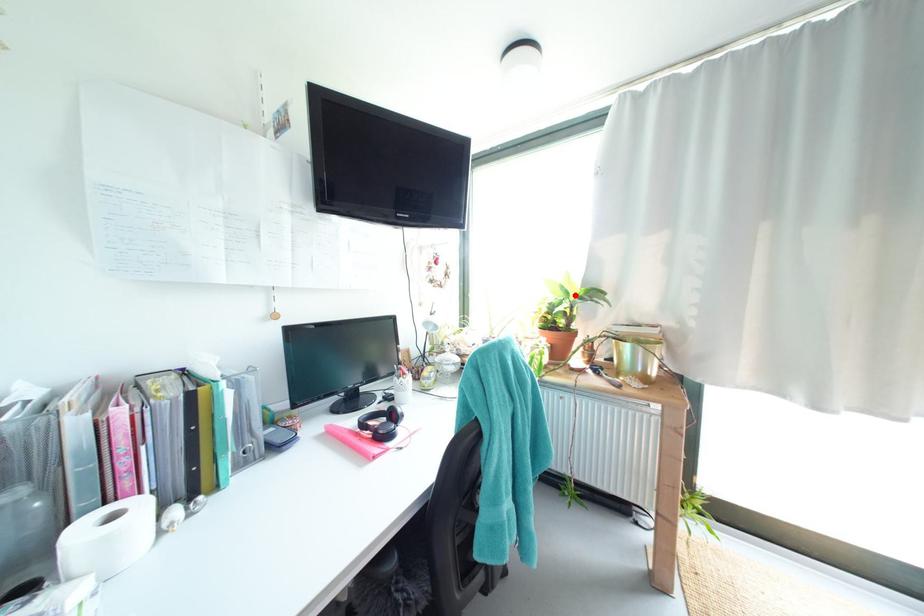
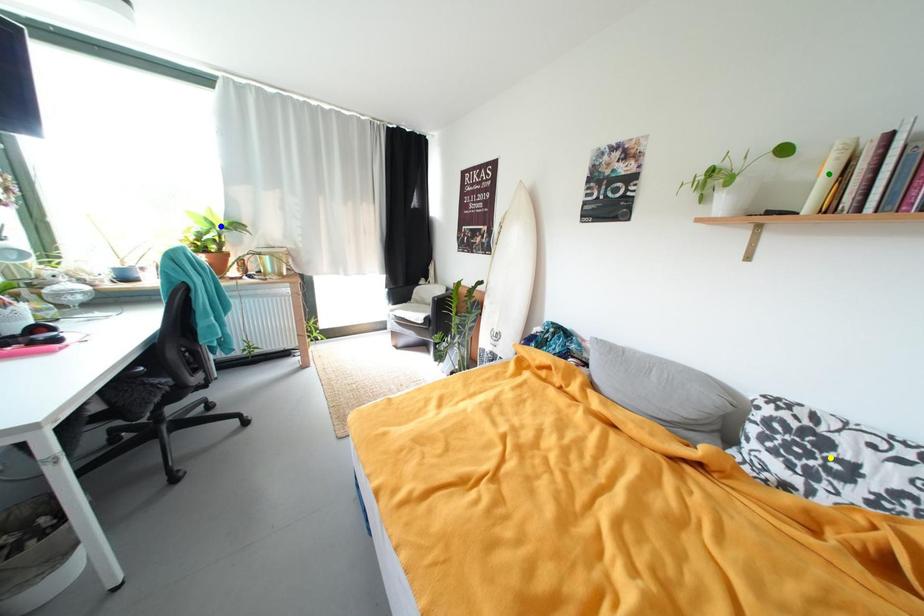
Question: I am providing you with two images of the same scene from different viewpoints. A red point is marked on the first image. You are given multiple points on the second image. In image 2, which mark is for the same physical point as the one in image 1?

Choices:
 (A) green point
 (B) yellow point
 (C) blue point

Answer: (C)